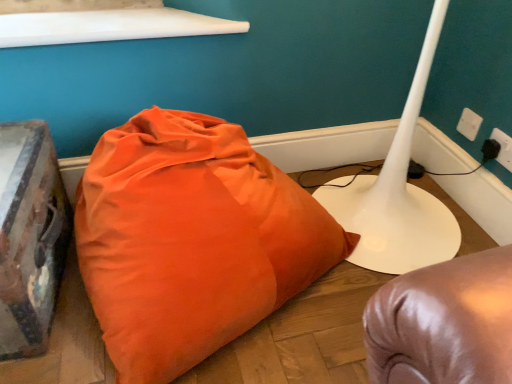
Question: In the image, is white plastic electric outlet at upper right, the 1th electric outlet when ordered from back to front, on the left side or the right side of white plastic electric outlet at upper right, the first electric outlet when ordered from right to left?

Choices:
 (A) left
 (B) right

Answer: (A)

Question: In terms of height, does white plastic electric outlet at upper right, which is counted as the second electric outlet, starting from the right, look taller or shorter compared to white plastic electric outlet at upper right, the first electric outlet when ordered from right to left?

Choices:
 (A) tall
 (B) short

Answer: (B)

Question: Considering the real-world distances, which object is closest to the white plastic electric outlet at upper right, which is the 1th electric outlet in front-to-back order?

Choices:
 (A) white glossy table lamp at lower right
 (B) white plastic electric outlet at upper right, which is the 2th electric outlet in front-to-back order
 (C) orange fabric pillow at center
 (D) black plastic plug at lower right

Answer: (D)

Question: Which object is positioned farthest from the black plastic plug at lower right?

Choices:
 (A) white plastic electric outlet at upper right, which is counted as the second electric outlet, starting from the right
 (B) orange fabric pillow at center
 (C) white plastic electric outlet at upper right, which appears as the 2th electric outlet when viewed from the back
 (D) white glossy table lamp at lower right

Answer: (B)